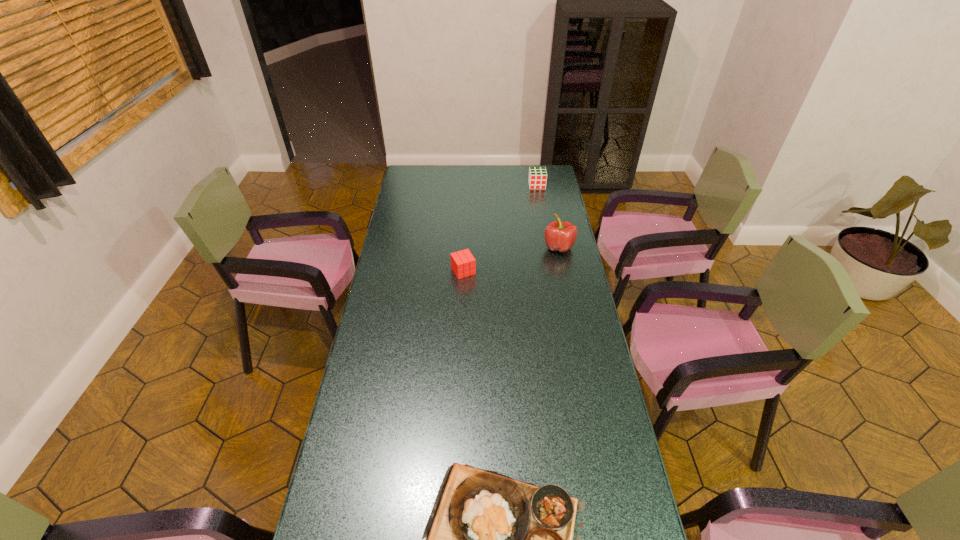
The width and height of the screenshot is (960, 540). Identify the location of the tallest object. (560, 236).

The image size is (960, 540). I want to click on the third nearest object, so click(x=560, y=236).

At what (x,y) coordinates should I click in order to perform the action: click on the farther cube. Please return your answer as a coordinate pair (x, y). The image size is (960, 540). Looking at the image, I should click on (537, 179).

I want to click on the farthest object, so click(x=537, y=179).

Locate an element on the screen. The width and height of the screenshot is (960, 540). the nearer cube is located at coordinates (463, 264).

At what (x,y) coordinates should I click in order to perform the action: click on the second nearest object. Please return your answer as a coordinate pair (x, y). Looking at the image, I should click on (463, 264).

Find the location of `vacant area located 0.140m on the left of the tallest object`. vacant area located 0.140m on the left of the tallest object is located at coordinates (512, 247).

The image size is (960, 540). What are the coordinates of `free space located on the red face of the farthest object` in the screenshot? It's located at (545, 234).

At what (x,y) coordinates should I click in order to perform the action: click on vacant position located on the back of the left cube. Please return your answer as a coordinate pair (x, y). This screenshot has height=540, width=960. Looking at the image, I should click on (465, 233).

This screenshot has width=960, height=540. I want to click on object at the far edge, so click(537, 179).